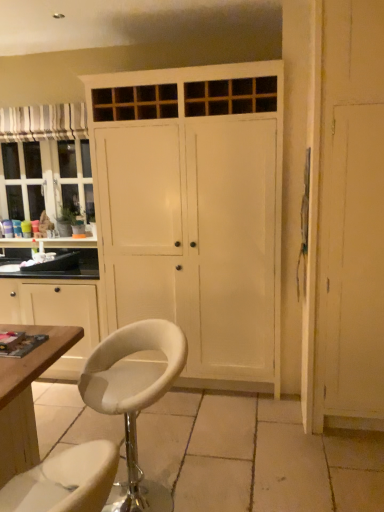
Question: Relative to wooden cabinet at left, is white painted wood cupboard at center in front or behind?

Choices:
 (A) front
 (B) behind

Answer: (A)

Question: Is white painted wood cupboard at center inside or outside of wooden cabinet at left?

Choices:
 (A) outside
 (B) inside

Answer: (A)

Question: Which of these objects is positioned closest to the striped fabric curtain at upper left?

Choices:
 (A) wooden screen door at right
 (B) white leather stool at center
 (C) wooden cabinet at left
 (D) white painted wood cupboard at center

Answer: (D)

Question: Which is nearer to the white painted wood cupboard at center?

Choices:
 (A) striped fabric curtain at upper left
 (B) white leather stool at center
 (C) wooden screen door at right
 (D) wooden cabinet at left

Answer: (D)